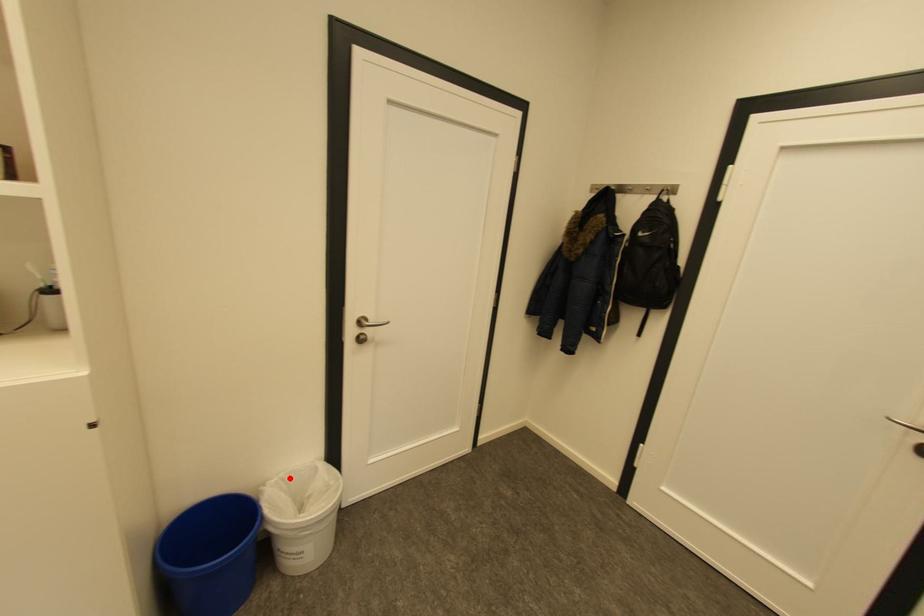
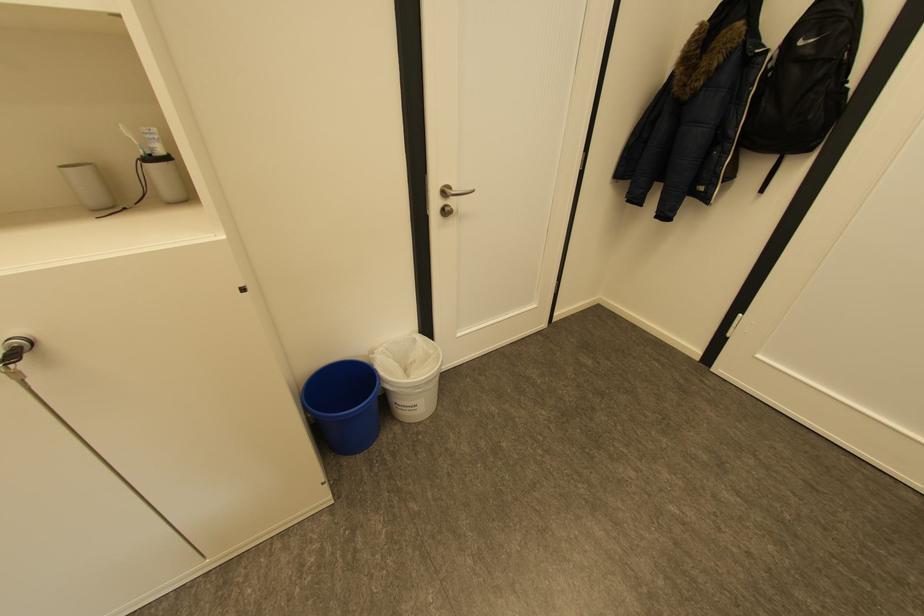
Find the pixel in the second image that matches the highlighted location in the first image.

(394, 349)